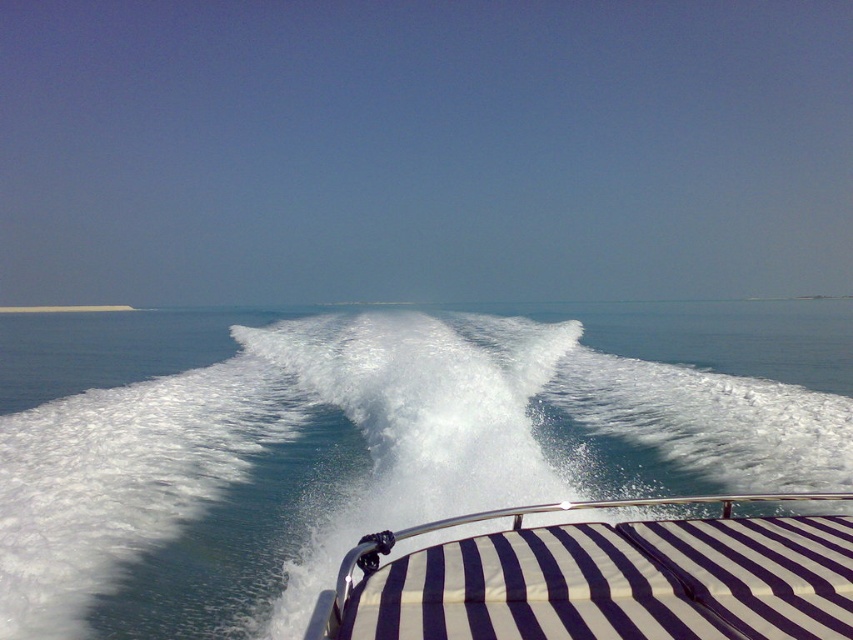
You are on a boat and notice two white elements in front of you. One is the white foamy water at center and the other is the white striped fabric at center. Which one is positioned to the right side?

The white foamy water at center is positioned to the right of the white striped fabric at center.

You are on a boat and want to know if the white foamy water at center is above or below the white striped fabric at center. Can you tell me based on the scene?

The white foamy water at center is located above the white striped fabric at center according to the description.

You are standing on the deck of a boat with a striped canopy and notice a point in the water ahead. The point is located at coordinates point (157, 328). Given that the boat is moving forward, will this point become closer to you as the boat continues its course?

The distance of point (157, 328) from viewer is 57.91 meters, so if the boat continues moving forward, the point will become closer to you as the boat approaches it.